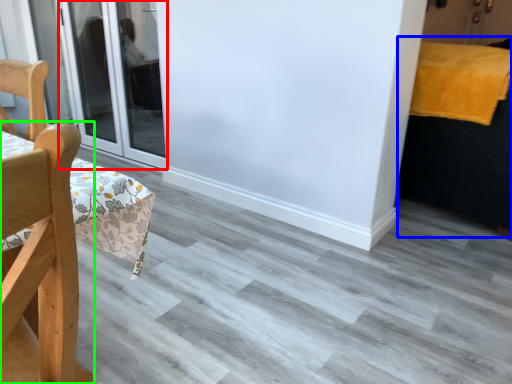
Question: Estimate the real-world distances between objects in this image. Which object is farther from door (highlighted by a red box), bed (highlighted by a blue box) or chair (highlighted by a green box)?

Choices:
 (A) bed
 (B) chair

Answer: (B)